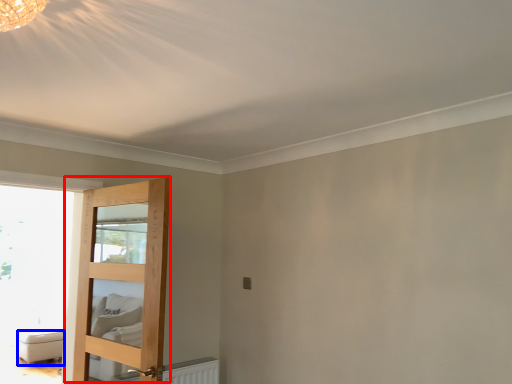
Question: Which object appears closest to the camera in this image, door (highlighted by a red box) or furniture (highlighted by a blue box)?

Choices:
 (A) door
 (B) furniture

Answer: (A)